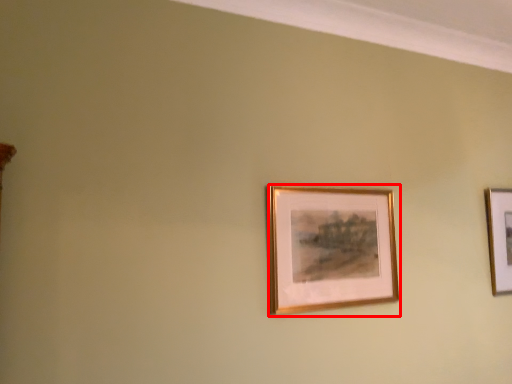
Question: From the image's perspective, what is the correct spatial positioning of picture frame (annotated by the red box) in reference to picture frame?

Choices:
 (A) below
 (B) above

Answer: (B)